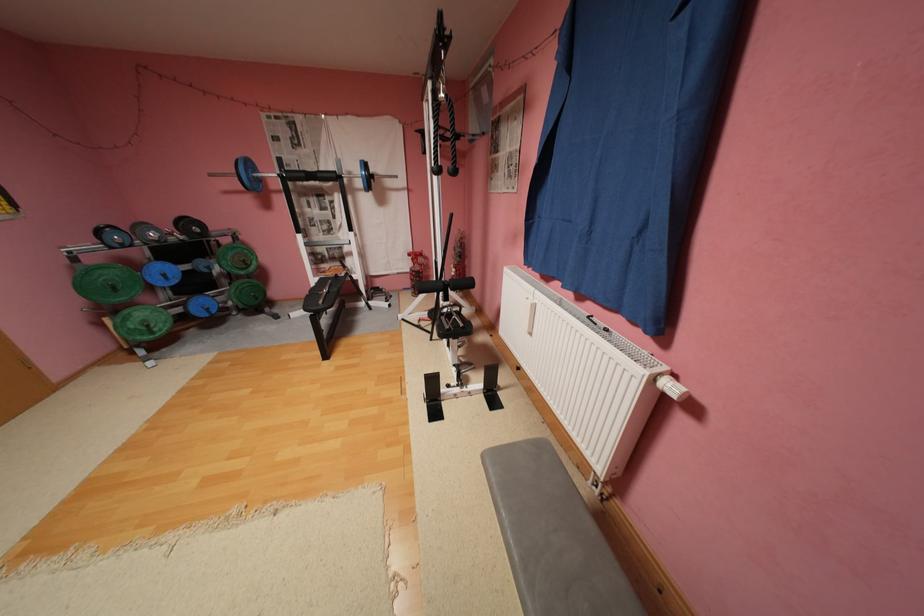
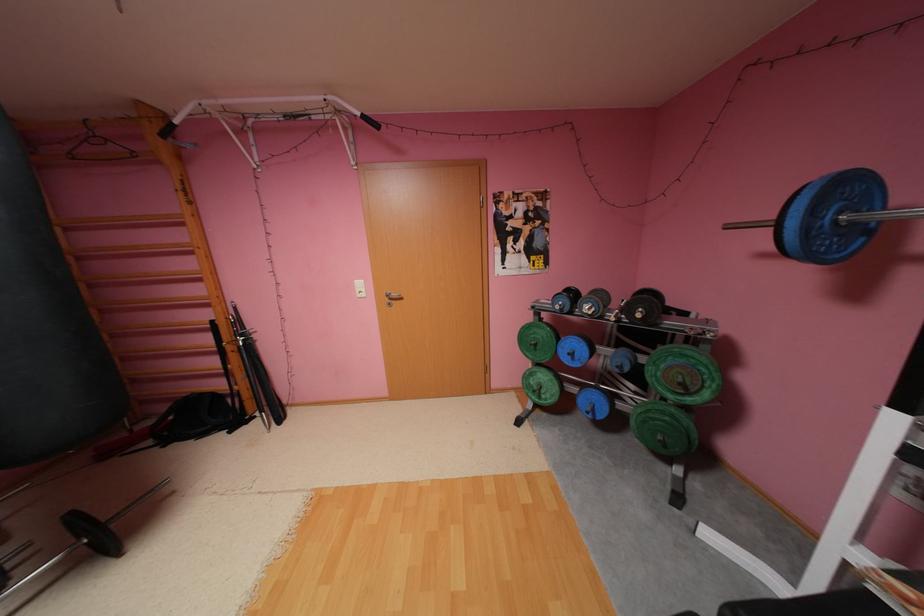
Locate, in the second image, the point that corresponds to (253,261) in the first image.

(690, 384)